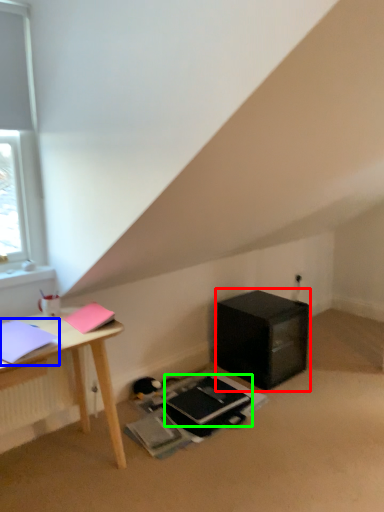
Question: Which object is the farthest from nightstand (highlighted by a red box)? Choose among these: notebook (highlighted by a blue box) or notebook (highlighted by a green box).

Choices:
 (A) notebook
 (B) notebook

Answer: (A)